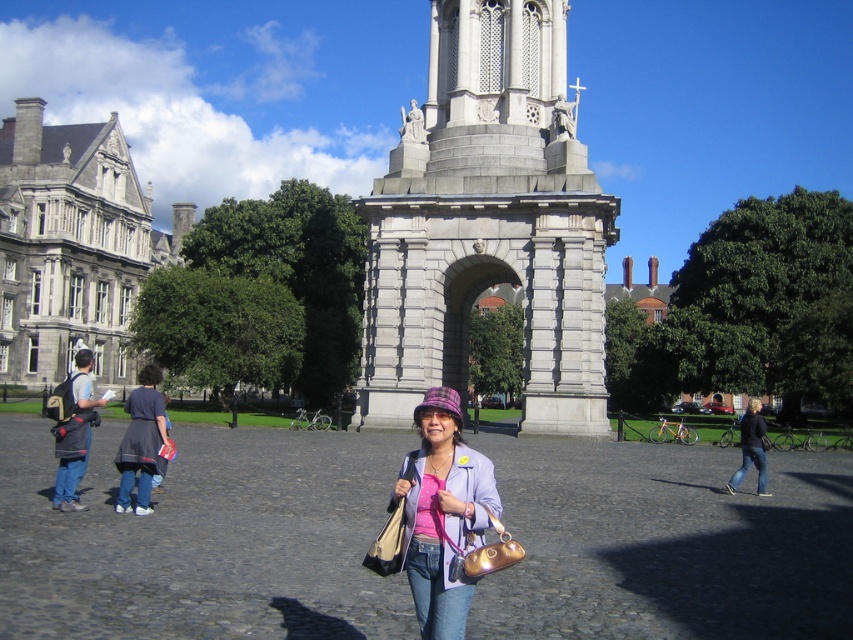
Between pink fabric hat at center and denim jacket at left, which one has more height?

Standing taller between the two is denim jacket at left.

Is pink fabric hat at center bigger than denim jacket at left?

No, pink fabric hat at center is not bigger than denim jacket at left.

Where is `pink fabric hat at center`? pink fabric hat at center is located at coordinates (442, 513).

In the scene shown: Does gray stone monument at center appear under denim jacket at left?

No, gray stone monument at center is not below denim jacket at left.

Between point (554, 100) and point (62, 497), which one is positioned behind?

The point (554, 100) is behind.

Who is more distant from viewer, (467, 180) or (61, 419)?

Point (467, 180)

The image size is (853, 640). I want to click on gray stone monument at center, so click(x=488, y=224).

Is pink fabric hat at center thinner than dark blue dress at left?

Yes, pink fabric hat at center is thinner than dark blue dress at left.

Between point (485, 460) and point (123, 492), which one is positioned in front?

Point (485, 460)

The height and width of the screenshot is (640, 853). Identify the location of pink fabric hat at center. (442, 513).